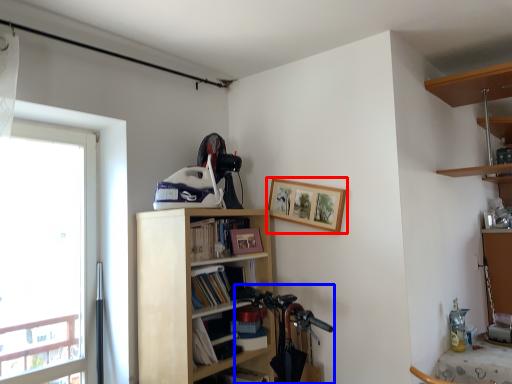
Question: Which object appears closest to the camera in this image, picture frame (highlighted by a red box) or mountain bike (highlighted by a blue box)?

Choices:
 (A) picture frame
 (B) mountain bike

Answer: (A)